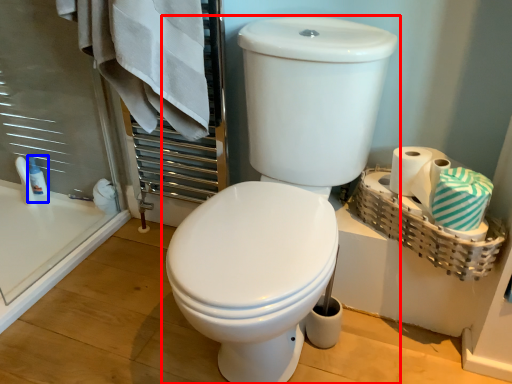
Question: Which point is closer to the camera, toilet (highlighted by a red box) or toiletry (highlighted by a blue box)?

Choices:
 (A) toilet
 (B) toiletry

Answer: (A)